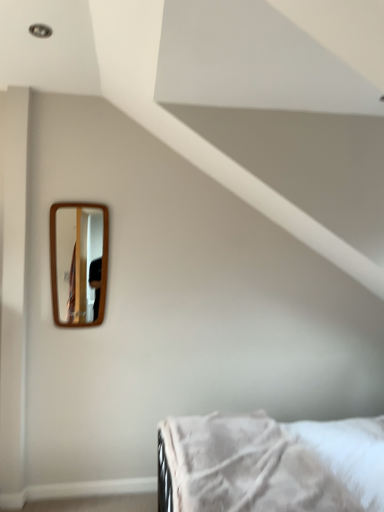
Question: Is white soft fabric bed at lower right positioned beyond the bounds of wooden-framed mirror at upper left?

Choices:
 (A) no
 (B) yes

Answer: (B)

Question: Is white soft fabric bed at lower right placed right next to wooden-framed mirror at upper left?

Choices:
 (A) yes
 (B) no

Answer: (B)

Question: Would you say white soft fabric bed at lower right is a long distance from wooden-framed mirror at upper left?

Choices:
 (A) yes
 (B) no

Answer: (A)

Question: Is white soft fabric bed at lower right aimed at wooden-framed mirror at upper left?

Choices:
 (A) no
 (B) yes

Answer: (A)

Question: From a real-world perspective, is white soft fabric bed at lower right located higher than wooden-framed mirror at upper left?

Choices:
 (A) yes
 (B) no

Answer: (B)

Question: Does white soft fabric bed at lower right lie in front of wooden-framed mirror at upper left?

Choices:
 (A) no
 (B) yes

Answer: (B)

Question: Is wooden-framed mirror at upper left not close to white soft fabric bed at lower right?

Choices:
 (A) no
 (B) yes

Answer: (B)

Question: Would you say wooden-framed mirror at upper left contains white soft fabric bed at lower right?

Choices:
 (A) yes
 (B) no

Answer: (B)

Question: Considering the relative positions of wooden-framed mirror at upper left and white soft fabric bed at lower right in the image provided, is wooden-framed mirror at upper left to the right of white soft fabric bed at lower right from the viewer's perspective?

Choices:
 (A) no
 (B) yes

Answer: (A)

Question: Is wooden-framed mirror at upper left oriented towards white soft fabric bed at lower right?

Choices:
 (A) yes
 (B) no

Answer: (B)

Question: Does wooden-framed mirror at upper left appear on the left side of white soft fabric bed at lower right?

Choices:
 (A) no
 (B) yes

Answer: (B)

Question: From the image's perspective, is wooden-framed mirror at upper left beneath white soft fabric bed at lower right?

Choices:
 (A) no
 (B) yes

Answer: (A)

Question: Based on their positions, is white soft fabric bed at lower right located to the left or right of wooden-framed mirror at upper left?

Choices:
 (A) right
 (B) left

Answer: (A)